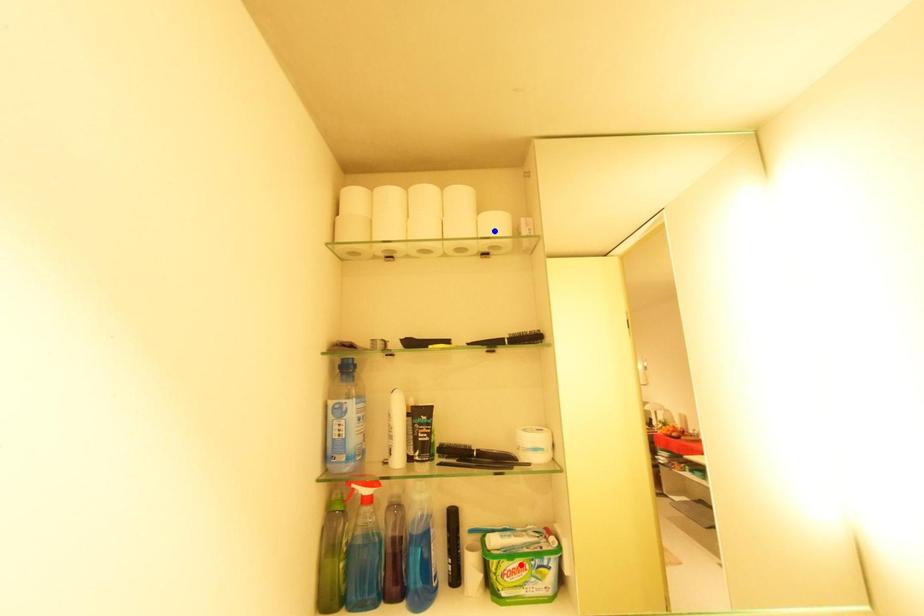
Question: In the image, two points are highlighted. Which point is nearer to the camera? Reply with the corresponding letter.

Choices:
 (A) blue point
 (B) red point

Answer: (B)